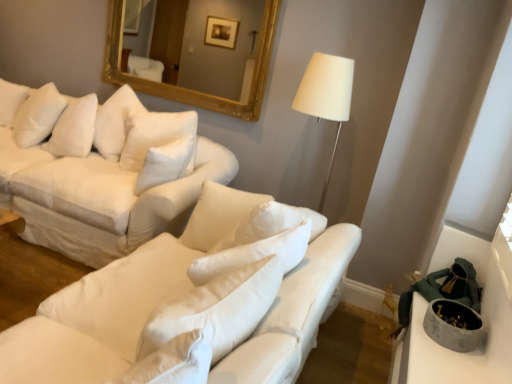
Question: Would you say gold-framed mirror at upper center is part of concrete bowl at lower right's contents?

Choices:
 (A) no
 (B) yes

Answer: (A)

Question: From a real-world perspective, does concrete bowl at lower right stand above gold-framed mirror at upper center?

Choices:
 (A) yes
 (B) no

Answer: (B)

Question: From the image's perspective, is concrete bowl at lower right below gold-framed mirror at upper center?

Choices:
 (A) no
 (B) yes

Answer: (B)

Question: Is concrete bowl at lower right facing towards gold-framed mirror at upper center?

Choices:
 (A) no
 (B) yes

Answer: (A)

Question: Is concrete bowl at lower right at the right side of gold-framed mirror at upper center?

Choices:
 (A) yes
 (B) no

Answer: (A)

Question: From the image's perspective, relative to concrete bowl at lower right, is white fabric couch at center, which ranks as the first studio couch in front-to-back order, above or below?

Choices:
 (A) below
 (B) above

Answer: (B)

Question: Is point (143, 309) positioned closer to the camera than point (488, 350)?

Choices:
 (A) farther
 (B) closer

Answer: (B)

Question: Considering the positions of white fabric couch at center, marked as the 2th studio couch in a back-to-front arrangement, and concrete bowl at lower right in the image, is white fabric couch at center, marked as the 2th studio couch in a back-to-front arrangement, bigger or smaller than concrete bowl at lower right?

Choices:
 (A) small
 (B) big

Answer: (B)

Question: Is white fabric couch at center, marked as the 2th studio couch in a back-to-front arrangement, in front of or behind concrete bowl at lower right in the image?

Choices:
 (A) front
 (B) behind

Answer: (A)

Question: Considering the positions of white soft pillow at upper left and white fabric couch at upper left, which is the second studio couch in front-to-back order, in the image, is white soft pillow at upper left bigger or smaller than white fabric couch at upper left, which is the second studio couch in front-to-back order,?

Choices:
 (A) small
 (B) big

Answer: (A)

Question: From the image's perspective, is white soft pillow at upper left positioned above or below white fabric couch at upper left, which is the second studio couch in front-to-back order?

Choices:
 (A) below
 (B) above

Answer: (B)

Question: Is white soft pillow at upper left to the left or to the right of white fabric couch at upper left, which is the second studio couch in front-to-back order, in the image?

Choices:
 (A) left
 (B) right

Answer: (A)

Question: Which is correct: white soft pillow at upper left is inside white fabric couch at upper left, which is the second studio couch in front-to-back order, or outside of it?

Choices:
 (A) inside
 (B) outside

Answer: (A)

Question: Looking at the image, does white fabric couch at center, marked as the 2th studio couch in a back-to-front arrangement, seem bigger or smaller compared to gold-framed mirror at upper center?

Choices:
 (A) big
 (B) small

Answer: (A)

Question: In the image, is white fabric couch at center, marked as the 2th studio couch in a back-to-front arrangement, on the left side or the right side of gold-framed mirror at upper center?

Choices:
 (A) right
 (B) left

Answer: (A)